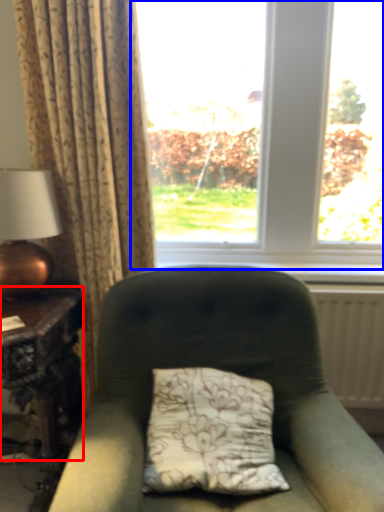
Question: Among these objects, which one is nearest to the camera, table (highlighted by a red box) or window (highlighted by a blue box)?

Choices:
 (A) table
 (B) window

Answer: (A)